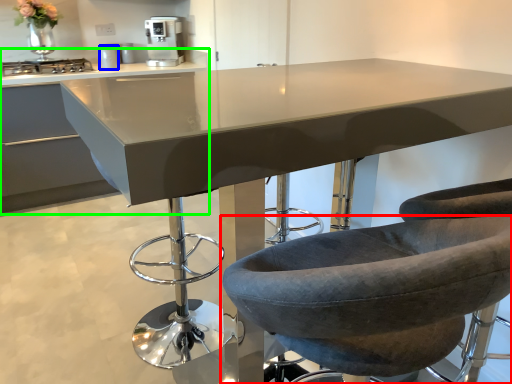
Question: Which is nearer to the chair (highlighted by a red box)? appliance (highlighted by a blue box) or cabinetry (highlighted by a green box).

Choices:
 (A) appliance
 (B) cabinetry

Answer: (B)